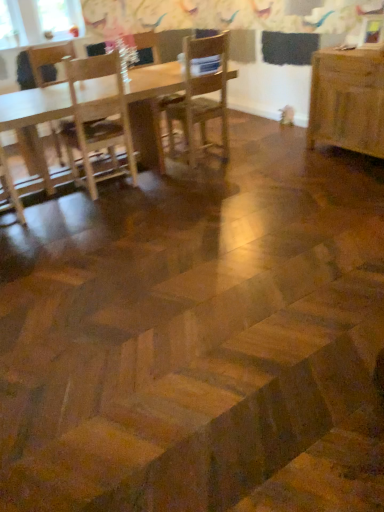
Question: Considering the relative sizes of clear glass window screen at upper left and wooden table at right, acting as the 2th table starting from the left, in the image provided, is clear glass window screen at upper left taller than wooden table at right, acting as the 2th table starting from the left,?

Choices:
 (A) no
 (B) yes

Answer: (A)

Question: Is clear glass window screen at upper left surrounding wooden table at right, acting as the 2th table starting from the left?

Choices:
 (A) yes
 (B) no

Answer: (B)

Question: Are clear glass window screen at upper left and wooden table at right, acting as the 2th table starting from the left, making contact?

Choices:
 (A) no
 (B) yes

Answer: (A)

Question: Considering the relative positions of clear glass window screen at upper left and wooden table at right, which is the 1th table in right-to-left order, in the image provided, is clear glass window screen at upper left to the right of wooden table at right, which is the 1th table in right-to-left order, from the viewer's perspective?

Choices:
 (A) no
 (B) yes

Answer: (A)

Question: Would you consider clear glass window screen at upper left to be distant from wooden table at right, acting as the 2th table starting from the left?

Choices:
 (A) no
 (B) yes

Answer: (B)

Question: Considering the relative sizes of clear glass window screen at upper left and wooden table at right, acting as the 2th table starting from the left, in the image provided, is clear glass window screen at upper left shorter than wooden table at right, acting as the 2th table starting from the left,?

Choices:
 (A) no
 (B) yes

Answer: (B)

Question: Is wooden chair at center, which is counted as the third chair, starting from the left, bigger than wooden table at right, which is the 1th table in right-to-left order?

Choices:
 (A) no
 (B) yes

Answer: (A)

Question: Can you confirm if wooden chair at center, which is counted as the third chair, starting from the left, is thinner than wooden table at right, which is the 1th table in right-to-left order?

Choices:
 (A) yes
 (B) no

Answer: (B)

Question: From a real-world perspective, does wooden chair at center, acting as the first chair starting from the right, sit lower than wooden table at right, acting as the 2th table starting from the left?

Choices:
 (A) yes
 (B) no

Answer: (B)

Question: From a real-world perspective, is wooden chair at center, acting as the first chair starting from the right, on top of wooden table at right, which is the 1th table in right-to-left order?

Choices:
 (A) no
 (B) yes

Answer: (B)

Question: Is wooden table at right, which is the 1th table in right-to-left order, surrounded by wooden chair at center, which is counted as the third chair, starting from the left?

Choices:
 (A) no
 (B) yes

Answer: (A)

Question: Is wooden chair at center, which is counted as the third chair, starting from the left, wider than wooden table at right, which is the 1th table in right-to-left order?

Choices:
 (A) no
 (B) yes

Answer: (B)

Question: From a real-world perspective, is wooden table at right, which is the 1th table in right-to-left order, positioned under wooden chair at center, positioned as the 2th chair in left-to-right order, based on gravity?

Choices:
 (A) no
 (B) yes

Answer: (B)